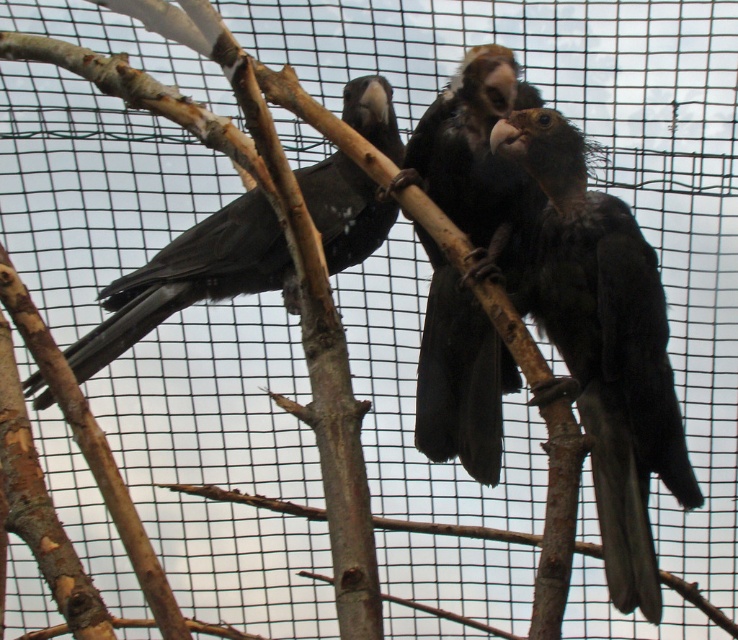
Consider the image. Who is positioned more to the right, black feathers at center or matte black bird at center?

black feathers at center

Locate an element on the screen. The image size is (738, 640). black feathers at center is located at coordinates (472, 257).

The image size is (738, 640). Find the location of `black feathers at center`. black feathers at center is located at coordinates (472, 257).

This screenshot has height=640, width=738. Identify the location of black feathers at center. (472, 257).

Is shiny black parrot at center to the right of black feathers at center from the viewer's perspective?

Indeed, shiny black parrot at center is positioned on the right side of black feathers at center.

Measure the distance from shiny black parrot at center to black feathers at center.

shiny black parrot at center is 6.68 inches from black feathers at center.

Locate an element on the screen. shiny black parrot at center is located at coordinates (604, 344).

This screenshot has height=640, width=738. I want to click on shiny black parrot at center, so 604,344.

The height and width of the screenshot is (640, 738). Describe the element at coordinates (604, 344) in the screenshot. I see `shiny black parrot at center` at that location.

Who is positioned more to the left, shiny black parrot at center or matte black bird at center?

From the viewer's perspective, matte black bird at center appears more on the left side.

Which is in front, point (604, 448) or point (182, 250)?

Point (604, 448) is in front.

The height and width of the screenshot is (640, 738). What are the coordinates of `shiny black parrot at center` in the screenshot? It's located at (604, 344).